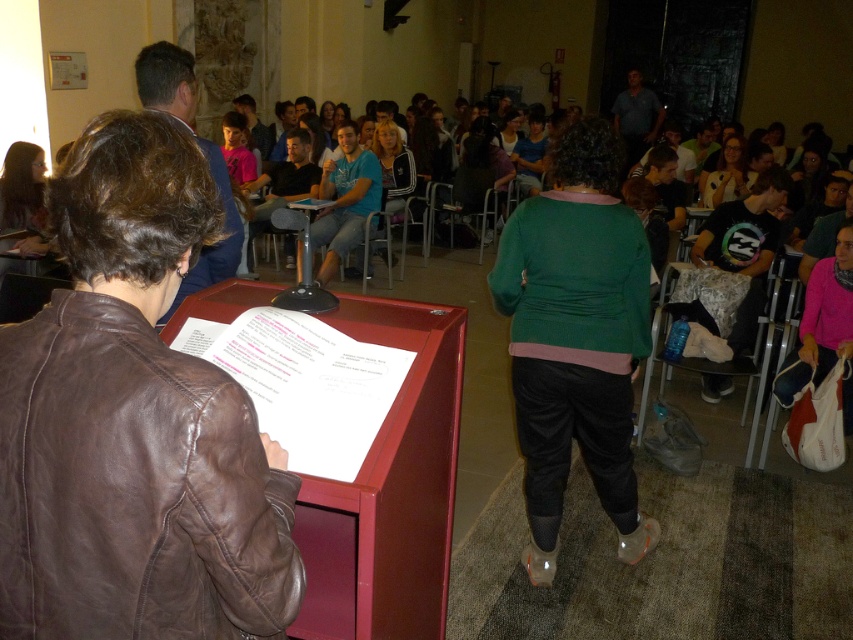
Can you confirm if green corduroy sweater at center is wider than metallic silver table at center?

Indeed, green corduroy sweater at center has a greater width compared to metallic silver table at center.

Does green corduroy sweater at center come in front of metallic silver table at center?

Yes.

Identify the location of green corduroy sweater at center. (575, 339).

Does metallic silver table at center have a lesser height compared to matte black glasses at upper right?

Yes, metallic silver table at center is shorter than matte black glasses at upper right.

Is point (285, 294) behind point (743, 179)?

No, (285, 294) is closer to viewer.

Based on the photo, who is more forward, (296, 216) or (738, 176)?

Point (296, 216)

Identify the location of metallic silver table at center. This screenshot has height=640, width=853. (302, 260).

Who is shorter, black fabric chair at lower right or metallic silver chair at center?

metallic silver chair at center is shorter.

Does black fabric chair at lower right have a larger size compared to metallic silver chair at center?

Yes.

Does point (743, 362) come behind point (495, 200)?

That is False.

I want to click on black fabric chair at lower right, so pos(727,360).